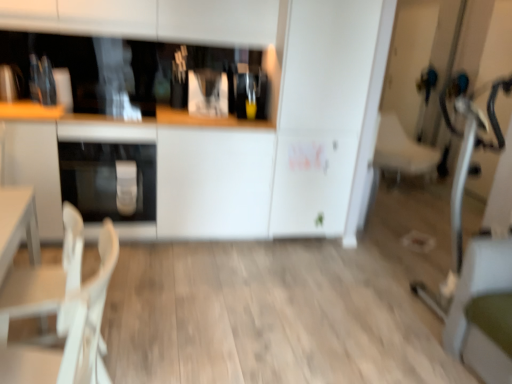
Question: Is the depth of white plastic chair at lower left, which is counted as the 2th armchair, starting from the right, greater than that of white fabric armchair at right, which is the 2th armchair in bottom-to-top order?

Choices:
 (A) no
 (B) yes

Answer: (A)

Question: Is white plastic chair at lower left, which is the first armchair from front to back, bigger than white fabric armchair at right, the first armchair from the top?

Choices:
 (A) no
 (B) yes

Answer: (A)

Question: Could you tell me if white plastic chair at lower left, marked as the first armchair in a bottom-to-top arrangement, is facing white fabric armchair at right, the first armchair from the top?

Choices:
 (A) no
 (B) yes

Answer: (A)

Question: Considering the relative positions of white plastic chair at lower left, placed as the 1th armchair when sorted from left to right, and white fabric armchair at right, which is the 2th armchair in bottom-to-top order, in the image provided, is white plastic chair at lower left, placed as the 1th armchair when sorted from left to right, to the right of white fabric armchair at right, which is the 2th armchair in bottom-to-top order, from the viewer's perspective?

Choices:
 (A) yes
 (B) no

Answer: (B)

Question: Can we say white plastic chair at lower left, which is counted as the 2th armchair, starting from the right, lies outside white fabric armchair at right, which is the 2th armchair in bottom-to-top order?

Choices:
 (A) yes
 (B) no

Answer: (A)

Question: Does white plastic chair at lower left, which is counted as the 2th armchair, starting from the right, have a lesser width compared to white fabric armchair at right, which is the 2th armchair in bottom-to-top order?

Choices:
 (A) no
 (B) yes

Answer: (B)

Question: Does wooden counter top at center have a smaller size compared to white plastic chair at lower left, placed as the 1th armchair when sorted from left to right?

Choices:
 (A) yes
 (B) no

Answer: (B)

Question: Is wooden counter top at center far from white plastic chair at lower left, which is counted as the 2th armchair, starting from the right?

Choices:
 (A) yes
 (B) no

Answer: (A)

Question: From a real-world perspective, is wooden counter top at center physically below white plastic chair at lower left, which is the second armchair in top-to-bottom order?

Choices:
 (A) yes
 (B) no

Answer: (B)

Question: Can we say wooden counter top at center lies outside white plastic chair at lower left, which is the first armchair from front to back?

Choices:
 (A) no
 (B) yes

Answer: (B)

Question: Does wooden counter top at center have a greater width compared to white plastic chair at lower left, placed as the second armchair when sorted from back to front?

Choices:
 (A) no
 (B) yes

Answer: (B)

Question: Does wooden counter top at center have a lesser width compared to white plastic chair at lower left, which is counted as the 2th armchair, starting from the right?

Choices:
 (A) yes
 (B) no

Answer: (B)

Question: Considering the relative positions of white plastic chair at lower left, which is the first armchair from front to back, and satin silver oven at lower left in the image provided, is white plastic chair at lower left, which is the first armchair from front to back, to the left of satin silver oven at lower left from the viewer's perspective?

Choices:
 (A) yes
 (B) no

Answer: (B)